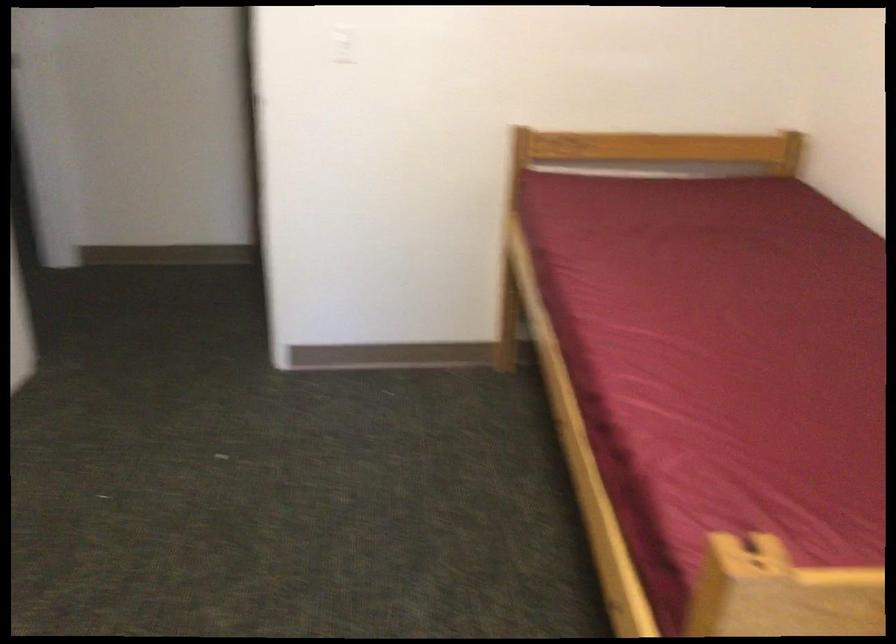
What do you see at coordinates (657, 147) in the screenshot? I see `a bed headboard` at bounding box center [657, 147].